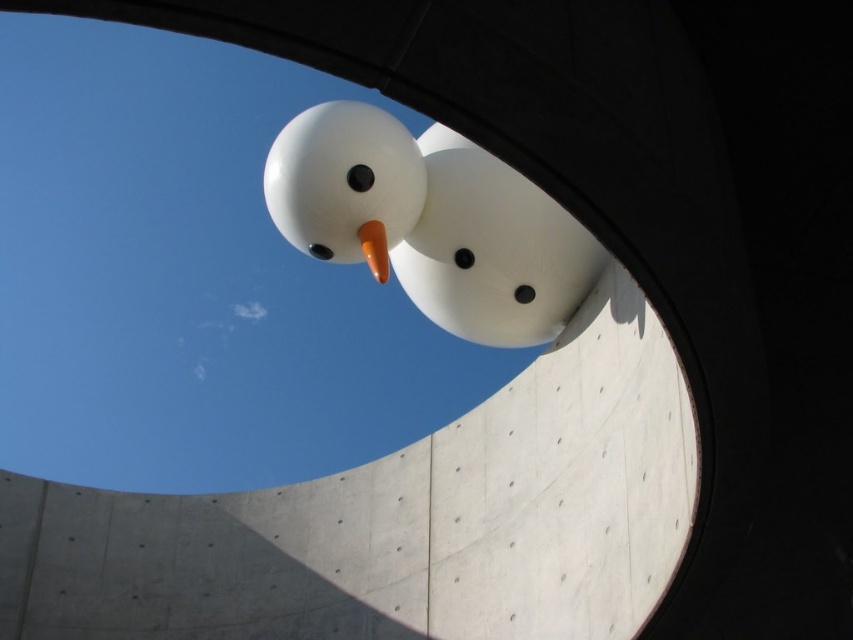
You are standing in front of the curved concrete structure and want to place a small decoration on the smooth concrete at center. Where should you place it so it stays below the white matte snowman at center?

The smooth concrete at center is already located below the white matte snowman at center, so placing the decoration on the smooth concrete at center will ensure it stays below the snowman.

You are standing in front of the snowman inside the curved wall. You notice two points marked on the wall. One is at coordinate point (608, 349) and the other at point (450, 284). Which point is closer to your eyes?

Point (608, 349) is closer to the camera than point (450, 284).

From the picture: You are standing in a park and see the smooth concrete at center. If you walk towards it, how far will you have to walk to reach it?

The smooth concrete at center is 28.33 meters away from the viewer, so you will have to walk 28.33 meters to reach it.